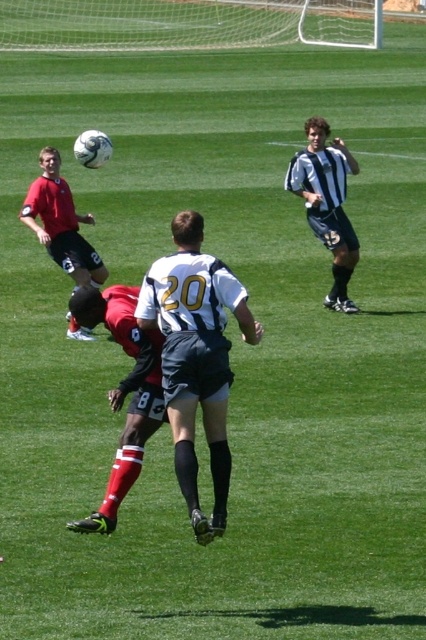
Question: Which object is closer to the camera taking this photo?

Choices:
 (A) striped jersey at center
 (B) matte red shirt at left

Answer: (B)

Question: Can you confirm if white matte jersey at center is wider than matte red shirt at left?

Choices:
 (A) no
 (B) yes

Answer: (A)

Question: Is white matte jersey at center smaller than matte red shirt at left?

Choices:
 (A) yes
 (B) no

Answer: (A)

Question: Can you confirm if white matte jersey at center is smaller than red matte soccer player at center?

Choices:
 (A) no
 (B) yes

Answer: (A)

Question: Among these objects, which one is farthest from the camera?

Choices:
 (A) red matte soccer player at center
 (B) matte red shirt at left
 (C) striped jersey at center

Answer: (C)

Question: Which of the following is the closest to the observer?

Choices:
 (A) matte red shirt at left
 (B) striped jersey at center

Answer: (A)